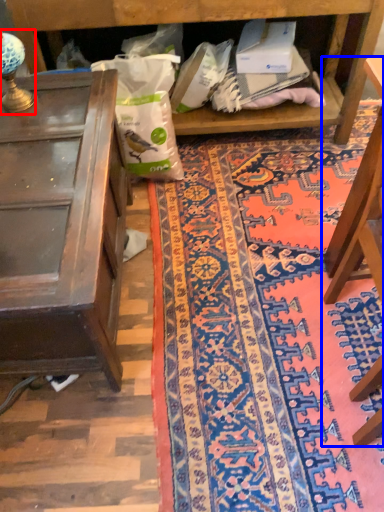
Question: Which object appears farthest to the camera in this image, lamp (highlighted by a red box) or furniture (highlighted by a blue box)?

Choices:
 (A) lamp
 (B) furniture

Answer: (A)